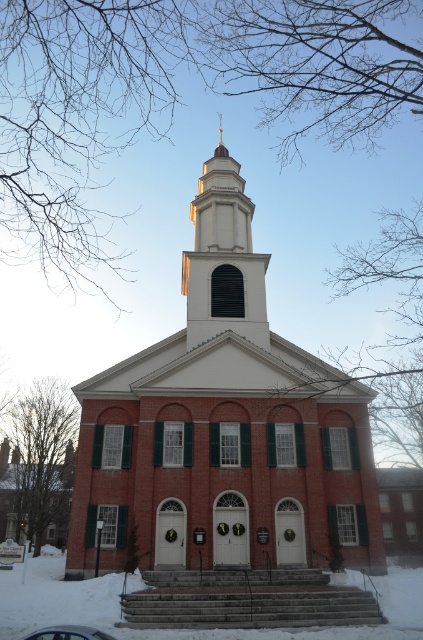
Question: Which point appears farthest from the camera in this image?

Choices:
 (A) (228, 300)
 (B) (55, 630)

Answer: (A)

Question: Estimate the real-world distances between objects in this image. Which object is closer to the brick church at center?

Choices:
 (A) metallic silver car at lower center
 (B) white smooth steeple at center

Answer: (B)

Question: Which object is the closest to the metallic silver car at lower center?

Choices:
 (A) brick church at center
 (B) white smooth steeple at center

Answer: (A)

Question: Can you confirm if white smooth steeple at center is positioned to the left of metallic silver car at lower center?

Choices:
 (A) no
 (B) yes

Answer: (A)

Question: Where is brick church at center located in relation to metallic silver car at lower center in the image?

Choices:
 (A) below
 (B) above

Answer: (B)

Question: Can you confirm if brick church at center is positioned to the right of white smooth steeple at center?

Choices:
 (A) no
 (B) yes

Answer: (B)